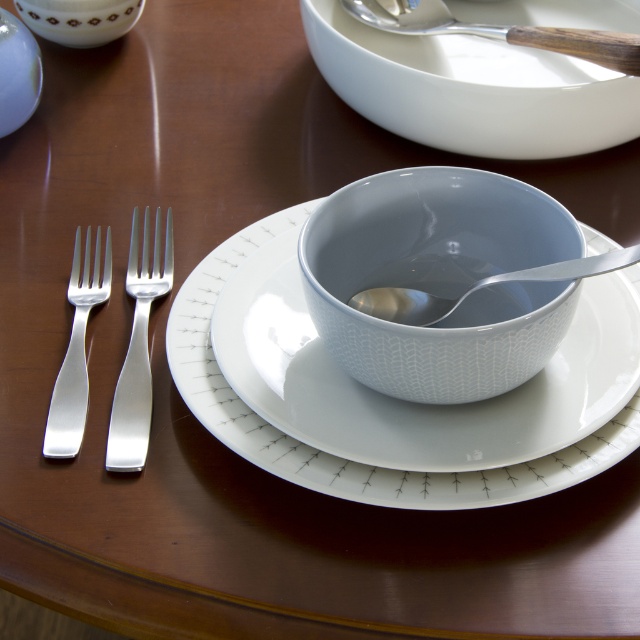
You are setting up a tea service and need to place a teacup on the table. The teacup requires a saucer that must be larger than the accompanying fork. Based on the image, can the white glossy saucer at center be used with the silver metallic fork at left?

The white glossy saucer at center is larger in size than the silver metallic fork at left, so yes, it can be used with the fork as it meets the size requirement.

You are standing 20 inches away from the table. Can you reach the point at coordinates point (122,413) without moving your position?

The point at coordinates point (122,413) is 17.67 inches away from the viewer. Since you are standing 20 inches away from the table, you can reach it without moving your position because the distance is within your reach range.

You are setting up a table for a formal dinner and need to place a decorative item between the white glossy saucer at center and the silver metallic fork at left. Given their sizes, which object should you place closer to the edge of the table to ensure stability?

The silver metallic fork at left should be placed closer to the edge of the table because its width is narrower than the white glossy saucer at center, making it less stable on its own.